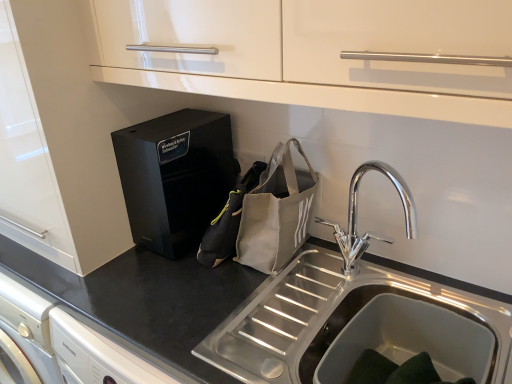
This screenshot has width=512, height=384. Identify the location of black glossy speaker at center. (175, 177).

In order to face black glossy speaker at center, should I rotate leftwards or rightwards?

Rotate your view left by about 10.107°.

Measure the distance between point (358, 237) and camera.

A distance of 1.19 meters exists between point (358, 237) and camera.

Measure the distance between chrome metallic faucet at upper right and camera.

The depth of chrome metallic faucet at upper right is 85.10 centimeters.

At what (x,y) coordinates should I click in order to perform the action: click on canvas tote bag at sink, arranged as the 2th pouch when viewed from the left. Please return your answer as a coordinate pair (x, y). The height and width of the screenshot is (384, 512). Looking at the image, I should click on (276, 212).

What do you see at coordinates (228, 221) in the screenshot? I see `gray fabric pouch at center, the second pouch viewed from the right` at bounding box center [228, 221].

This screenshot has width=512, height=384. Identify the location of black glossy speaker at center. (175, 177).

Is gray fabric pouch at center, placed as the 1th pouch when sorted from left to right, thinner than black matte countertop at center?

Yes, gray fabric pouch at center, placed as the 1th pouch when sorted from left to right, is thinner than black matte countertop at center.

Does gray fabric pouch at center, placed as the 1th pouch when sorted from left to right, lie behind black matte countertop at center?

That is True.

Which of these two, gray fabric pouch at center, placed as the 1th pouch when sorted from left to right, or black matte countertop at center, stands taller?

black matte countertop at center is taller.

Locate an element on the screen. Image resolution: width=512 pixels, height=384 pixels. countertop below the gray fabric pouch at center, the second pouch viewed from the right (from a real-world perspective) is located at coordinates pyautogui.click(x=147, y=298).

In the image, is black matte countertop at center positioned in front of or behind black glossy speaker at center?

black matte countertop at center is in front of black glossy speaker at center.

Is black matte countertop at center not close to black glossy speaker at center?

No, there isn't a large distance between black matte countertop at center and black glossy speaker at center.

In terms of size, does black matte countertop at center appear bigger or smaller than black glossy speaker at center?

In the image, black matte countertop at center appears to be larger than black glossy speaker at center.

Starting from the chrome metallic faucet at upper right, which pouch is the 2nd one to the left? Please provide its 2D coordinates.

[(228, 221)]

Which is behind, chrome metallic faucet at upper right or gray fabric pouch at center, the second pouch viewed from the right?

gray fabric pouch at center, the second pouch viewed from the right, is further away from the camera.

Between chrome metallic faucet at upper right and gray fabric pouch at center, placed as the 1th pouch when sorted from left to right, which one has smaller width?

Thinner between the two is chrome metallic faucet at upper right.

Is black matte countertop at center not near canvas tote bag at sink, arranged as the 2th pouch when viewed from the left?

black matte countertop at center is near canvas tote bag at sink, arranged as the 2th pouch when viewed from the left, not far away.

Who is more distant, black matte countertop at center or canvas tote bag at sink, positioned as the 1th pouch in right-to-left order?

canvas tote bag at sink, positioned as the 1th pouch in right-to-left order, is further away from the camera.

From a real-world perspective, starting from the black matte countertop at center, which pouch is the 2nd one vertically above it? Please provide its 2D coordinates.

[(276, 212)]

Considering the relative sizes of black matte countertop at center and canvas tote bag at sink, positioned as the 1th pouch in right-to-left order, in the image provided, is black matte countertop at center bigger than canvas tote bag at sink, positioned as the 1th pouch in right-to-left order,?

Yes, black matte countertop at center is bigger than canvas tote bag at sink, positioned as the 1th pouch in right-to-left order.

What's the angular difference between gray fabric pouch at center, the second pouch viewed from the right, and canvas tote bag at sink, arranged as the 2th pouch when viewed from the left,'s facing directions?

There is a 70.9-degree angle between the facing directions of gray fabric pouch at center, the second pouch viewed from the right, and canvas tote bag at sink, arranged as the 2th pouch when viewed from the left.

Which is more to the right, gray fabric pouch at center, the second pouch viewed from the right, or canvas tote bag at sink, positioned as the 1th pouch in right-to-left order?

Positioned to the right is canvas tote bag at sink, positioned as the 1th pouch in right-to-left order.

Is gray fabric pouch at center, placed as the 1th pouch when sorted from left to right, placed right next to canvas tote bag at sink, arranged as the 2th pouch when viewed from the left?

Indeed, gray fabric pouch at center, placed as the 1th pouch when sorted from left to right, and canvas tote bag at sink, arranged as the 2th pouch when viewed from the left, are beside each other and touching.

In the scene shown: From a real-world perspective, between gray fabric pouch at center, placed as the 1th pouch when sorted from left to right, and canvas tote bag at sink, arranged as the 2th pouch when viewed from the left, who is vertically higher?

From a 3D spatial view, canvas tote bag at sink, arranged as the 2th pouch when viewed from the left, is above.

Is black glossy speaker at center outside of canvas tote bag at sink, arranged as the 2th pouch when viewed from the left?

Yes, black glossy speaker at center is not within canvas tote bag at sink, arranged as the 2th pouch when viewed from the left.

Relative to canvas tote bag at sink, arranged as the 2th pouch when viewed from the left, is black glossy speaker at center in front or behind?

black glossy speaker at center is behind canvas tote bag at sink, arranged as the 2th pouch when viewed from the left.

Considering the positions of points (149, 122) and (287, 253), is point (149, 122) farther from camera compared to point (287, 253)?

Yes.

Are black glossy speaker at center and canvas tote bag at sink, positioned as the 1th pouch in right-to-left order, making contact?

No, black glossy speaker at center is not in contact with canvas tote bag at sink, positioned as the 1th pouch in right-to-left order.

Considering the positions of objects canvas tote bag at sink, positioned as the 1th pouch in right-to-left order, and black matte countertop at center in the image provided, who is in front, canvas tote bag at sink, positioned as the 1th pouch in right-to-left order, or black matte countertop at center?

Positioned in front is black matte countertop at center.

Is canvas tote bag at sink, positioned as the 1th pouch in right-to-left order, turned away from black matte countertop at center?

That's not correct — canvas tote bag at sink, positioned as the 1th pouch in right-to-left order, is not looking away from black matte countertop at center.

Considering the relative sizes of canvas tote bag at sink, positioned as the 1th pouch in right-to-left order, and black matte countertop at center in the image provided, is canvas tote bag at sink, positioned as the 1th pouch in right-to-left order, wider than black matte countertop at center?

No.

Is canvas tote bag at sink, arranged as the 2th pouch when viewed from the left, placed right next to black matte countertop at center?

No, canvas tote bag at sink, arranged as the 2th pouch when viewed from the left, is not in contact with black matte countertop at center.

Identify the location of the 1st pouch above the black matte countertop at center (from a real-world perspective). (228, 221).

In order to click on countertop on the right of the black glossy speaker at center in this screenshot , I will do `click(147, 298)`.

Looking at the image, which one is located closer to canvas tote bag at sink, arranged as the 2th pouch when viewed from the left, chrome metallic faucet at upper right or black glossy speaker at center?

Among the two, chrome metallic faucet at upper right is located nearer to canvas tote bag at sink, arranged as the 2th pouch when viewed from the left.

Looking at the image, which one is located further to black glossy speaker at center, chrome metallic faucet at upper right or canvas tote bag at sink, arranged as the 2th pouch when viewed from the left?

The object further to black glossy speaker at center is chrome metallic faucet at upper right.

Which object lies nearer to the anchor point chrome metallic faucet at upper right, black matte countertop at center or canvas tote bag at sink, arranged as the 2th pouch when viewed from the left?

The object closer to chrome metallic faucet at upper right is canvas tote bag at sink, arranged as the 2th pouch when viewed from the left.

Looking at the image, which one is located closer to black matte countertop at center, chrome metallic faucet at upper right or gray fabric pouch at center, the second pouch viewed from the right?

gray fabric pouch at center, the second pouch viewed from the right, is positioned closer to the anchor black matte countertop at center.

Looking at the image, which one is located further to canvas tote bag at sink, arranged as the 2th pouch when viewed from the left, black matte countertop at center or chrome metallic faucet at upper right?

The object further to canvas tote bag at sink, arranged as the 2th pouch when viewed from the left, is black matte countertop at center.

Based on their spatial positions, is black matte countertop at center or canvas tote bag at sink, arranged as the 2th pouch when viewed from the left, further from gray fabric pouch at center, placed as the 1th pouch when sorted from left to right?

black matte countertop at center.

Based on their spatial positions, is black matte countertop at center or gray fabric pouch at center, the second pouch viewed from the right, further from canvas tote bag at sink, arranged as the 2th pouch when viewed from the left?

black matte countertop at center is positioned further to the anchor canvas tote bag at sink, arranged as the 2th pouch when viewed from the left.

Estimate the real-world distances between objects in this image. Which object is closer to black glossy speaker at center, black matte countertop at center or gray fabric pouch at center, placed as the 1th pouch when sorted from left to right?

Among the two, gray fabric pouch at center, placed as the 1th pouch when sorted from left to right, is located nearer to black glossy speaker at center.

This screenshot has height=384, width=512. Identify the location of pouch located between black glossy speaker at center and canvas tote bag at sink, positioned as the 1th pouch in right-to-left order, in the left-right direction. (228, 221).

You are a GUI agent. You are given a task and a screenshot of the screen. Output one action in this format:
    pyautogui.click(x=<x>, y=<y>)
    Task: Click on the tap between canvas tote bag at sink, arranged as the 2th pouch when viewed from the left, and black matte countertop at center vertically
    The width and height of the screenshot is (512, 384).
    Given the screenshot: What is the action you would take?
    pyautogui.click(x=356, y=216)

Where is `tap that lies between black glossy speaker at center and black matte countertop at center from top to bottom`? tap that lies between black glossy speaker at center and black matte countertop at center from top to bottom is located at coordinates (356, 216).

Where is `pouch situated between gray fabric pouch at center, the second pouch viewed from the right, and chrome metallic faucet at upper right from left to right`? pouch situated between gray fabric pouch at center, the second pouch viewed from the right, and chrome metallic faucet at upper right from left to right is located at coordinates (276, 212).